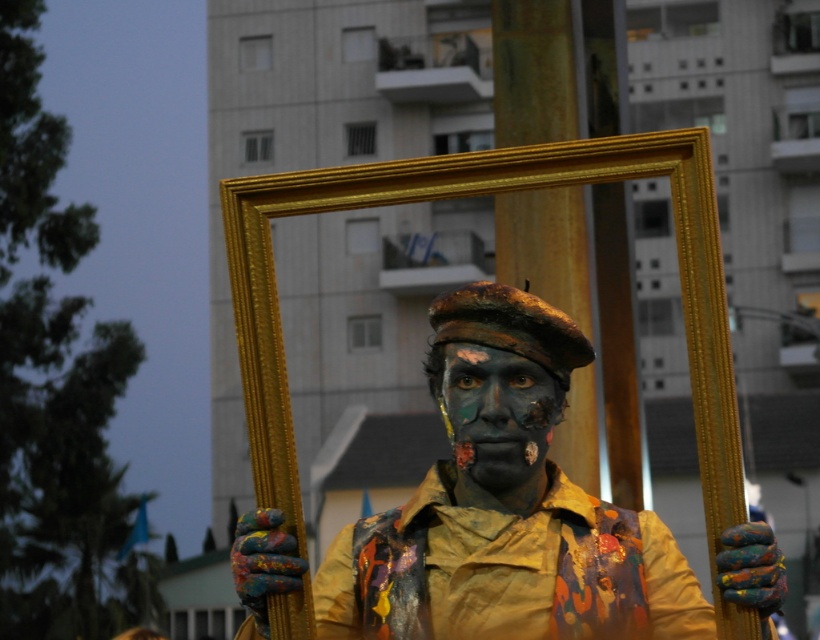
Is point (317, 605) farther from viewer compared to point (472, 378)?

No.

Who is more distant from viewer, (x=568, y=588) or (x=517, y=429)?

The point (x=517, y=429) is behind.

Locate an element on the screen. painted fabric street artist at center is located at coordinates (504, 506).